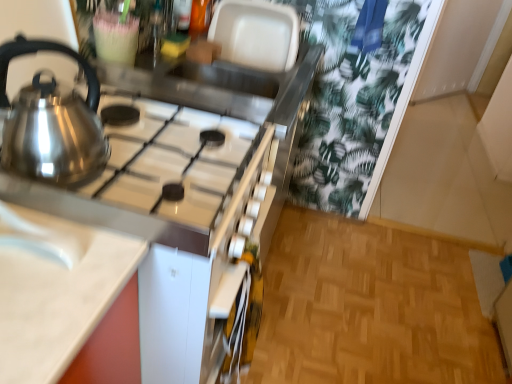
Question: Is the position of white glossy sink at lower left more distant than that of satin metallic kettle at left?

Choices:
 (A) yes
 (B) no

Answer: (B)

Question: Does white glossy sink at lower left turn towards satin metallic kettle at left?

Choices:
 (A) no
 (B) yes

Answer: (A)

Question: Does white glossy sink at lower left have a lesser width compared to satin metallic kettle at left?

Choices:
 (A) no
 (B) yes

Answer: (A)

Question: Considering the relative sizes of white glossy sink at lower left and satin metallic kettle at left in the image provided, is white glossy sink at lower left shorter than satin metallic kettle at left?

Choices:
 (A) yes
 (B) no

Answer: (A)

Question: From a real-world perspective, is white glossy sink at lower left on satin metallic kettle at left?

Choices:
 (A) yes
 (B) no

Answer: (B)

Question: Is white glossy sink at lower left facing away from satin metallic kettle at left?

Choices:
 (A) no
 (B) yes

Answer: (A)

Question: Does satin silver gas stove at upper left contain satin metallic kettle at left?

Choices:
 (A) yes
 (B) no

Answer: (B)

Question: Would you say satin silver gas stove at upper left is a long distance from satin metallic kettle at left?

Choices:
 (A) yes
 (B) no

Answer: (B)

Question: Is satin silver gas stove at upper left to the left of satin metallic kettle at left from the viewer's perspective?

Choices:
 (A) yes
 (B) no

Answer: (B)

Question: From a real-world perspective, does satin silver gas stove at upper left sit lower than satin metallic kettle at left?

Choices:
 (A) yes
 (B) no

Answer: (A)

Question: Is satin silver gas stove at upper left directly adjacent to satin metallic kettle at left?

Choices:
 (A) yes
 (B) no

Answer: (B)

Question: From a real-world perspective, does satin silver gas stove at upper left stand above satin metallic kettle at left?

Choices:
 (A) yes
 (B) no

Answer: (B)

Question: Is white glossy sink at lower left further to the viewer compared to satin silver gas stove at upper left?

Choices:
 (A) yes
 (B) no

Answer: (B)